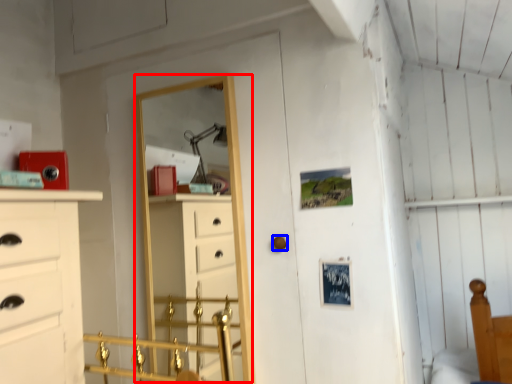
Question: Which point is closer to the camera, mirror (highlighted by a red box) or door handle (highlighted by a blue box)?

Choices:
 (A) mirror
 (B) door handle

Answer: (B)